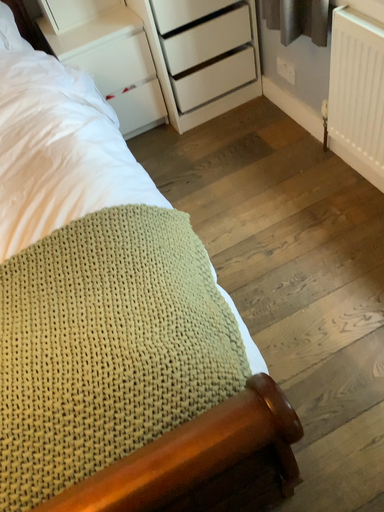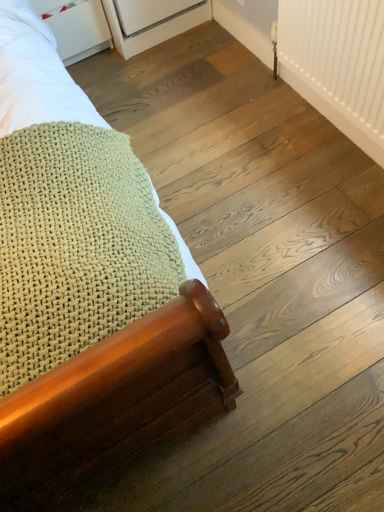
Question: How did the camera likely rotate when shooting the video?

Choices:
 (A) rotated downward
 (B) rotated upward

Answer: (A)